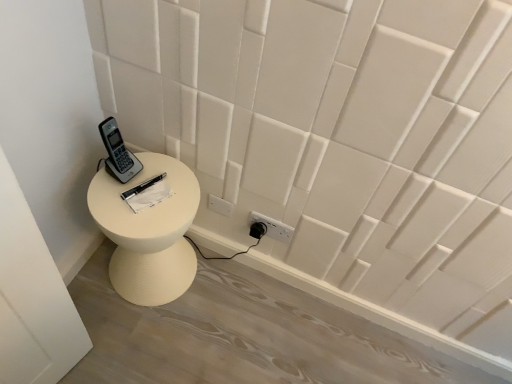
Image resolution: width=512 pixels, height=384 pixels. What are the coordinates of `vacant area located to the right-hand side of gray plastic phone at upper left` in the screenshot? It's located at (167, 182).